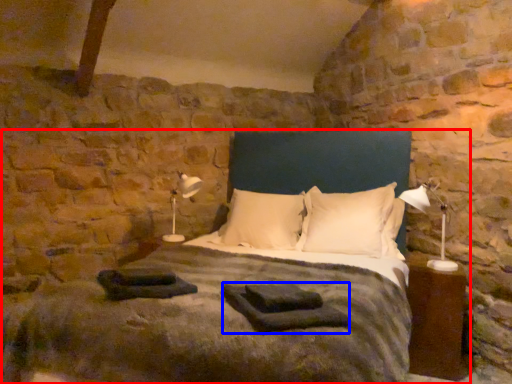
Question: Which object is closer to the camera taking this photo, bed (highlighted by a red box) or material (highlighted by a blue box)?

Choices:
 (A) bed
 (B) material

Answer: (A)